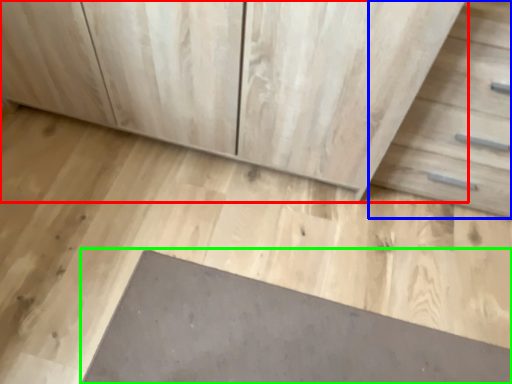
Question: Based on their relative distances, which object is nearer to chest of drawers (highlighted by a red box)? Choose from drawer (highlighted by a blue box) and slate (highlighted by a green box).

Choices:
 (A) drawer
 (B) slate

Answer: (A)